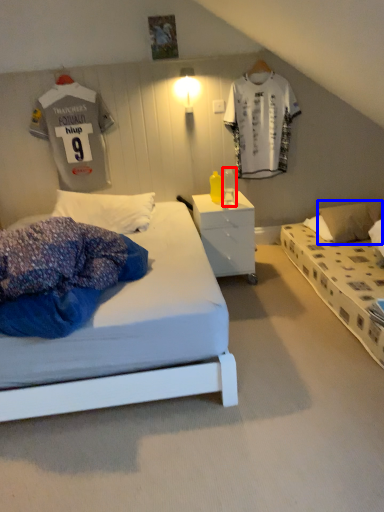
Question: Which object is further to the camera taking this photo, table lamp (highlighted by a red box) or pillow (highlighted by a blue box)?

Choices:
 (A) table lamp
 (B) pillow

Answer: (B)